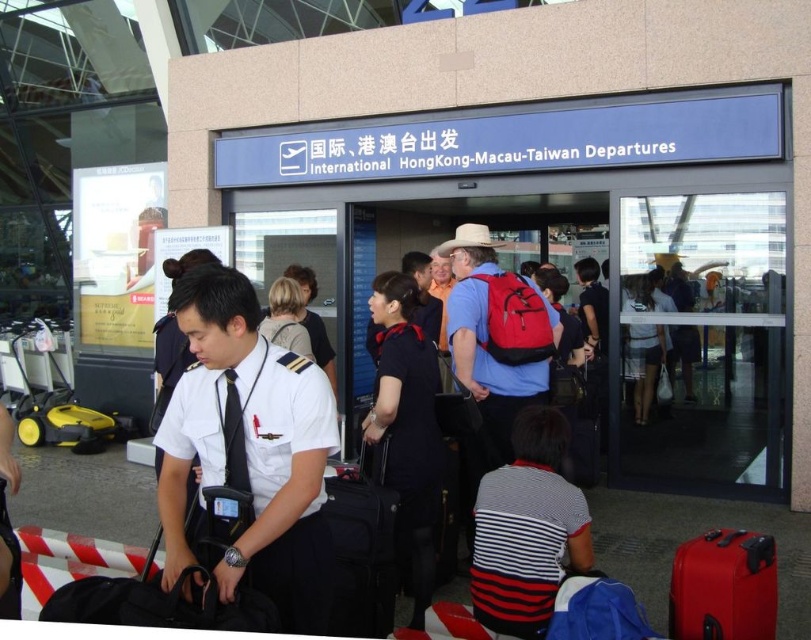
Consider the image. Please describe the exact position of the blonde hair at center in the image using coordinates.

The blonde hair at center is located at the 2D coordinates of point (286,317).

From the picture: What is the color of the object located at point (361, 548) in the image?

The object at point (361, 548) is a black fabric suitcase.

You are a traveler at the International Hong Kong Macau Taiwan Departures area. You see a man with blonde hair at center and a light brown leather jacket at center. Which object is taller?

The blonde hair at center is not as tall as the light brown leather jacket at center, so the light brown leather jacket at center is taller.